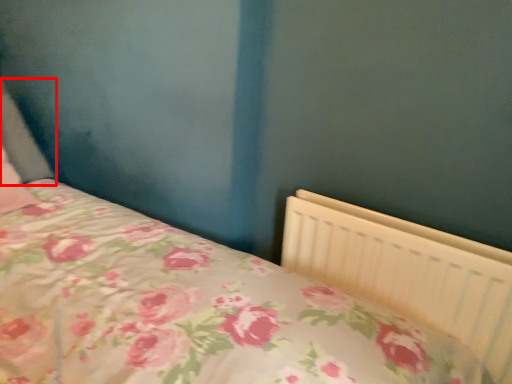
Question: Considering the relative positions of pillow (annotated by the red box) and radiator in the image provided, where is pillow (annotated by the red box) located with respect to the staircase?

Choices:
 (A) left
 (B) right

Answer: (A)